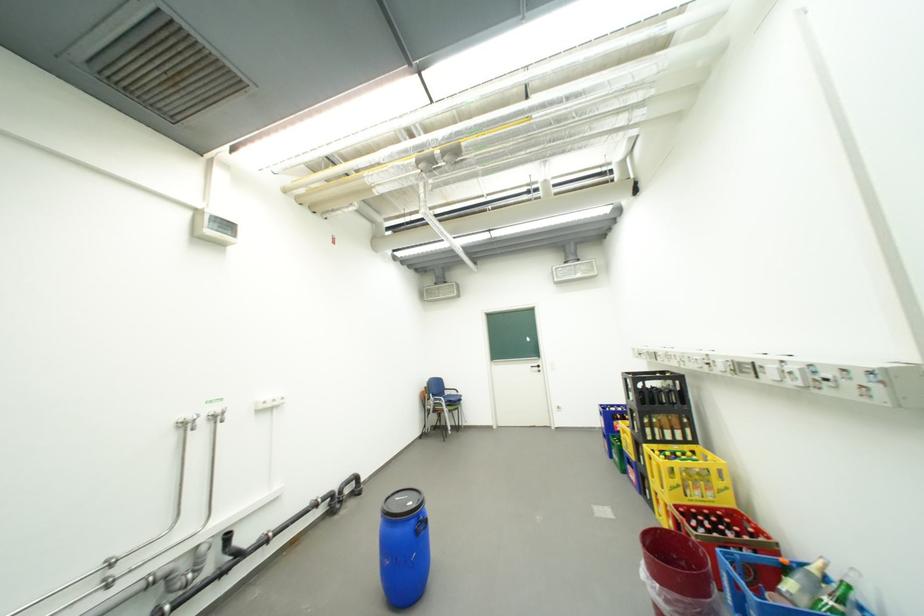
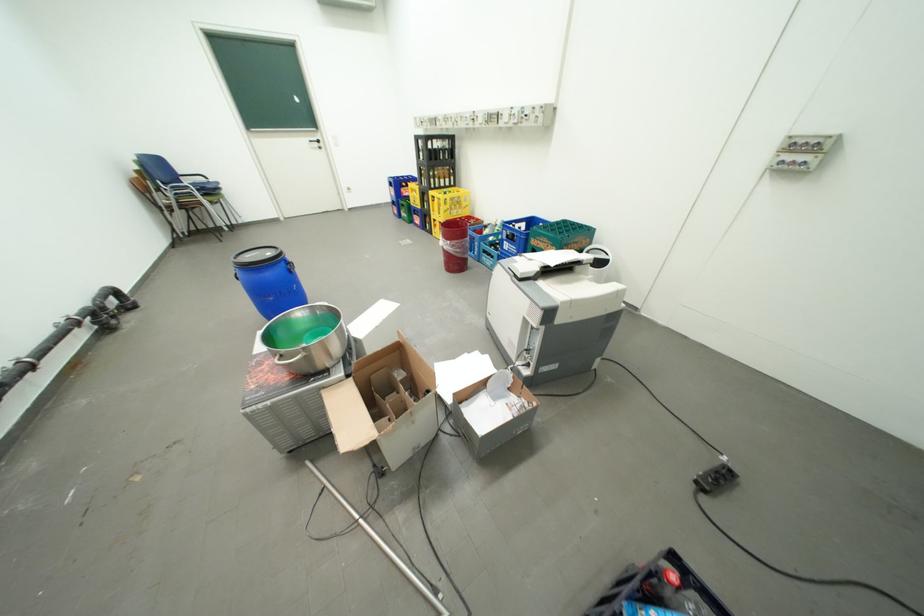
In the second image, find the point that corresponds to [639,399] in the first image.

(430, 159)